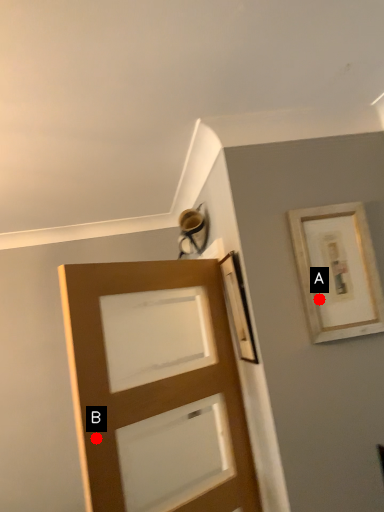
Question: Two points are circled on the image, labeled by A and B beside each circle. Which point is closer to the camera taking this photo?

Choices:
 (A) A is closer
 (B) B is closer

Answer: (B)